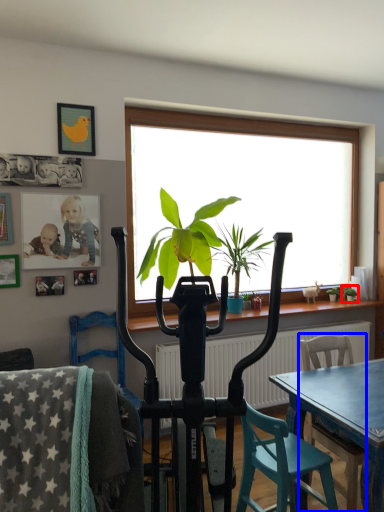
Question: Among these objects, which one is nearest to the camera, houseplant (highlighted by a red box) or chair (highlighted by a blue box)?

Choices:
 (A) houseplant
 (B) chair

Answer: (B)